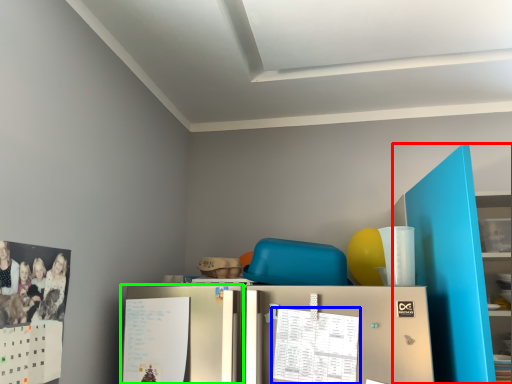
Question: Considering the real-world distances, which object is closest to bookshelf (highlighted by a red box)? calendar (highlighted by a blue box) or fridge (highlighted by a green box).

Choices:
 (A) calendar
 (B) fridge

Answer: (A)